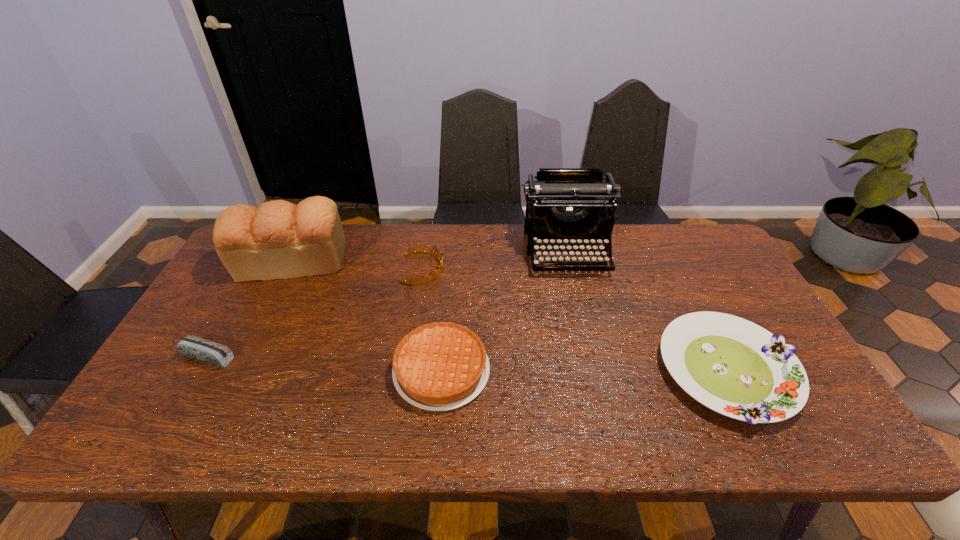
You are a GUI agent. You are given a task and a screenshot of the screen. Output one action in this format:
    pyautogui.click(x=<x>, y=<y>)
    Task: Click on the blank area located on the right of the pencil box
    This screenshot has height=540, width=960.
    Given the screenshot: What is the action you would take?
    pyautogui.click(x=264, y=356)

Where is `vacant position located on the back of the rightmost object`? This screenshot has height=540, width=960. vacant position located on the back of the rightmost object is located at coordinates (667, 251).

You are a GUI agent. You are given a task and a screenshot of the screen. Output one action in this format:
    pyautogui.click(x=<x>, y=<y>)
    Task: Click on the typewriter at the far edge
    The width and height of the screenshot is (960, 540).
    Given the screenshot: What is the action you would take?
    pyautogui.click(x=564, y=203)

Locate an element on the screen. Image resolution: width=960 pixels, height=540 pixels. bread at the far edge is located at coordinates (279, 240).

At what (x,y) coordinates should I click in order to perform the action: click on tiara located in the far edge section of the desktop. Please return your answer as a coordinate pair (x, y). Looking at the image, I should click on (415, 250).

Locate an element on the screen. pie that is positioned at the near edge is located at coordinates (439, 366).

You are a GUI agent. You are given a task and a screenshot of the screen. Output one action in this format:
    pyautogui.click(x=<x>, y=<y>)
    Task: Click on the salad plate that is at the near edge
    Image resolution: width=960 pixels, height=540 pixels.
    Given the screenshot: What is the action you would take?
    pyautogui.click(x=735, y=367)

Where is `bread that is at the left edge`? This screenshot has width=960, height=540. bread that is at the left edge is located at coordinates (279, 240).

Where is `pencil box present at the left edge`? pencil box present at the left edge is located at coordinates (210, 352).

Identify the location of object situated at the right edge. The image size is (960, 540). (735, 367).